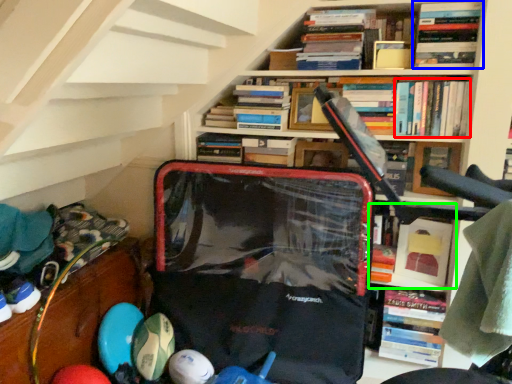
Question: Which is farther away from book (highlighted by a red box)? book (highlighted by a blue box) or book (highlighted by a green box)?

Choices:
 (A) book
 (B) book

Answer: (B)